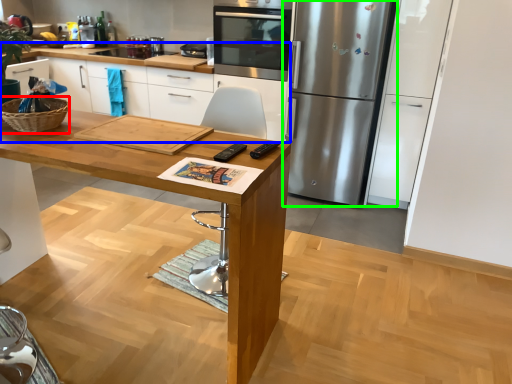
Question: Which object is positioned closest to basket (highlighted by a red box)? Select from cabinetry (highlighted by a blue box) and refrigerator (highlighted by a green box).

Choices:
 (A) cabinetry
 (B) refrigerator

Answer: (B)